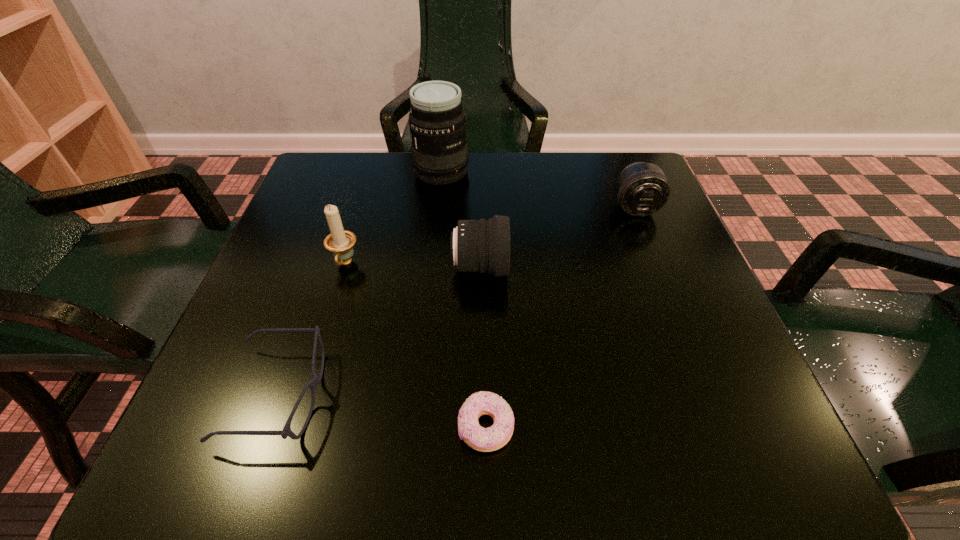
The width and height of the screenshot is (960, 540). In order to click on vacant space situated 0.320m at the front element of the nearest telephoto lens in this screenshot , I will do `click(673, 268)`.

What are the coordinates of `vacant space located 0.130m on the front-facing side of the rightmost telephoto lens` in the screenshot? It's located at (657, 262).

Locate an element on the screen. The width and height of the screenshot is (960, 540). free space located 0.170m on the front-facing side of the spectacles is located at coordinates (439, 395).

Image resolution: width=960 pixels, height=540 pixels. What are the coordinates of `free point located 0.110m on the back of the doughnut` in the screenshot? It's located at (485, 341).

Locate an element on the screen. Image resolution: width=960 pixels, height=540 pixels. spectacles present at the near edge is located at coordinates coord(286,431).

Where is `doughnut situated at the near edge`? This screenshot has height=540, width=960. doughnut situated at the near edge is located at coordinates (482, 439).

Identify the location of candle_holder that is at the left edge. Image resolution: width=960 pixels, height=540 pixels. (340, 242).

The height and width of the screenshot is (540, 960). Find the location of `spectacles positioned at the left edge`. spectacles positioned at the left edge is located at coordinates (286, 431).

You are a GUI agent. You are given a task and a screenshot of the screen. Output one action in this format:
    pyautogui.click(x=<x>, y=<y>)
    Task: Click on the object located at the right edge
    The image size is (960, 540).
    Given the screenshot: What is the action you would take?
    pyautogui.click(x=642, y=189)

Where is `object located in the near left corner section of the desktop`? Image resolution: width=960 pixels, height=540 pixels. object located in the near left corner section of the desktop is located at coordinates (286, 431).